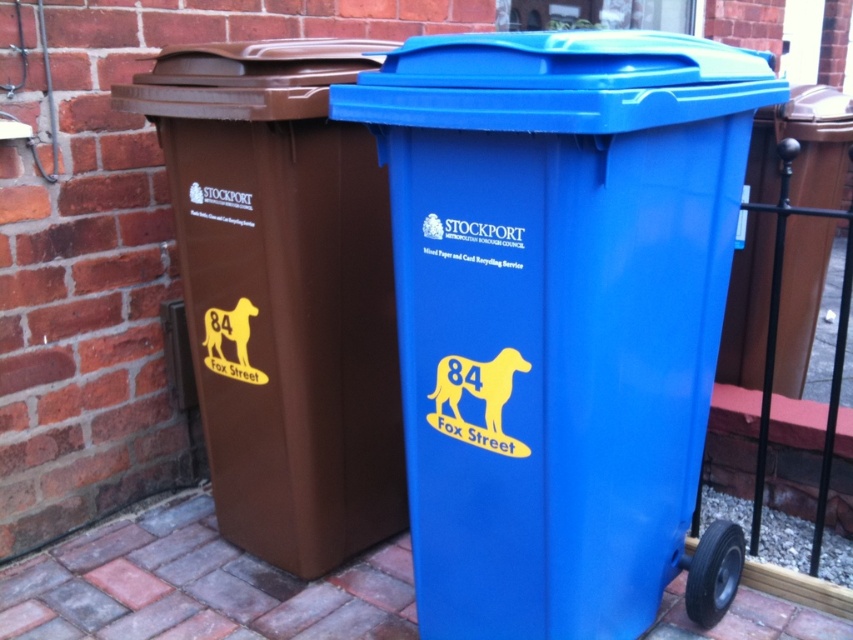
Question: Which of the following is the farthest from the observer?

Choices:
 (A) (671, 188)
 (B) (242, 304)
 (C) (399, 552)
 (D) (709, 554)

Answer: (C)

Question: Can you confirm if brick pavement at lower left is thinner than blue plastic bin at right?

Choices:
 (A) no
 (B) yes

Answer: (A)

Question: Is blue plastic recycling bin at center bigger than blue plastic bin at right?

Choices:
 (A) no
 (B) yes

Answer: (B)

Question: Which point appears closest to the camera in this image?

Choices:
 (A) (267, 625)
 (B) (730, 531)
 (C) (778, 131)

Answer: (B)

Question: Which point is farther to the camera?

Choices:
 (A) blue plastic bin at right
 (B) blue plastic recycling bin at center

Answer: (A)

Question: Can you confirm if blue plastic recycling bin at center is positioned above brick pavement at lower left?

Choices:
 (A) no
 (B) yes

Answer: (B)